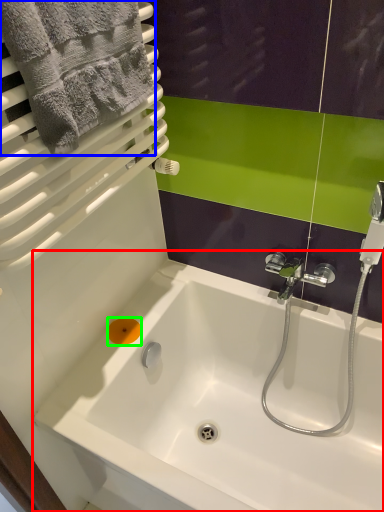
Question: Estimate the real-world distances between objects in this image. Which object is closer to bathtub (highlighted by a red box), towel (highlighted by a blue box) or soap (highlighted by a green box)?

Choices:
 (A) towel
 (B) soap

Answer: (B)